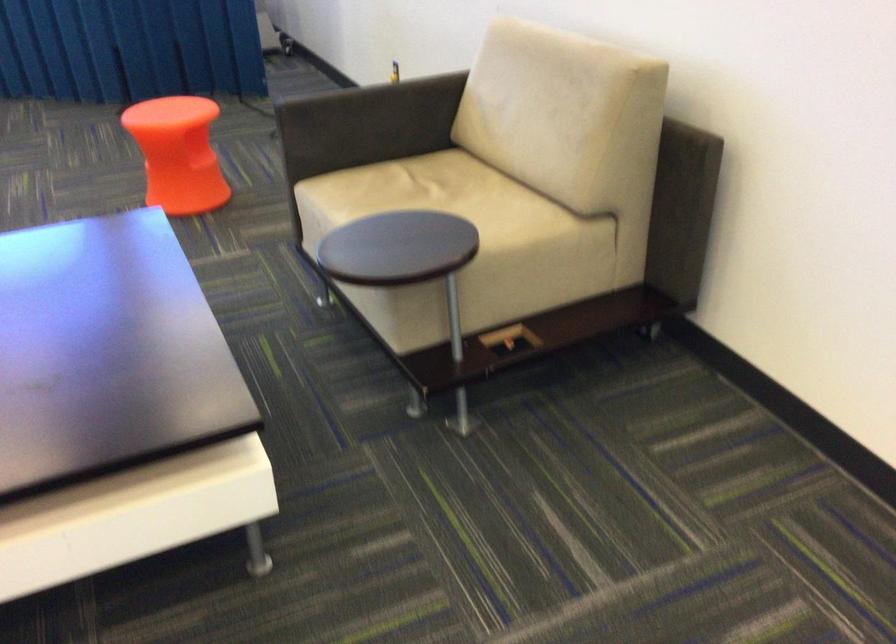
This screenshot has height=644, width=896. In order to click on sofa armrest in this screenshot , I will do `click(365, 87)`.